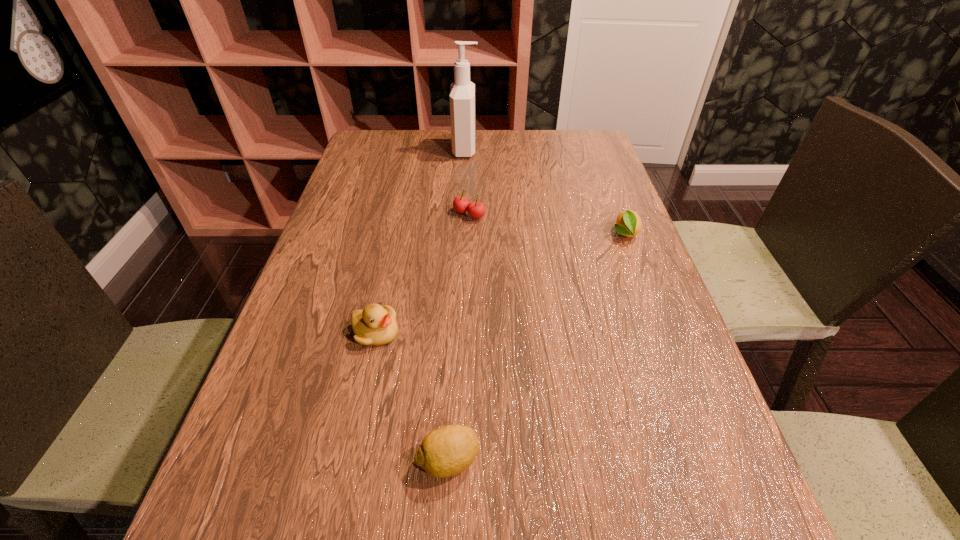
At what (x,y) coordinates should I click in order to perform the action: click on the tallest object. Please return your answer as a coordinate pair (x, y). This screenshot has height=540, width=960. Looking at the image, I should click on (462, 92).

The height and width of the screenshot is (540, 960). I want to click on the farthest object, so click(x=462, y=92).

Identify the location of the fourth farthest object. The image size is (960, 540). (375, 325).

Identify the location of the leftmost object. (375, 325).

Locate an element on the screen. The image size is (960, 540). cherry is located at coordinates [x=475, y=209].

Locate an element on the screen. The width and height of the screenshot is (960, 540). the nearer lemon is located at coordinates (448, 450).

Where is `the left lemon`? This screenshot has width=960, height=540. the left lemon is located at coordinates (x=448, y=450).

This screenshot has width=960, height=540. I want to click on the rightmost object, so click(628, 223).

This screenshot has height=540, width=960. I want to click on the farther lemon, so [x=628, y=223].

You are a GUI agent. You are given a task and a screenshot of the screen. Output one action in this format:
    pyautogui.click(x=<x>, y=<y>)
    Task: Click on the free space located 0.320m on the front label of the farthest object
    
    Given the screenshot: What is the action you would take?
    pyautogui.click(x=584, y=150)